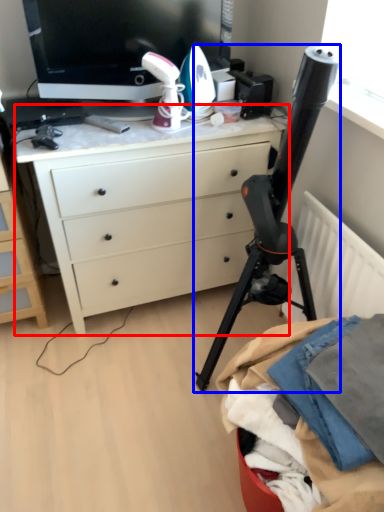
Question: Which point is closer to the camera, desk (highlighted by a red box) or tripod (highlighted by a blue box)?

Choices:
 (A) desk
 (B) tripod

Answer: (B)